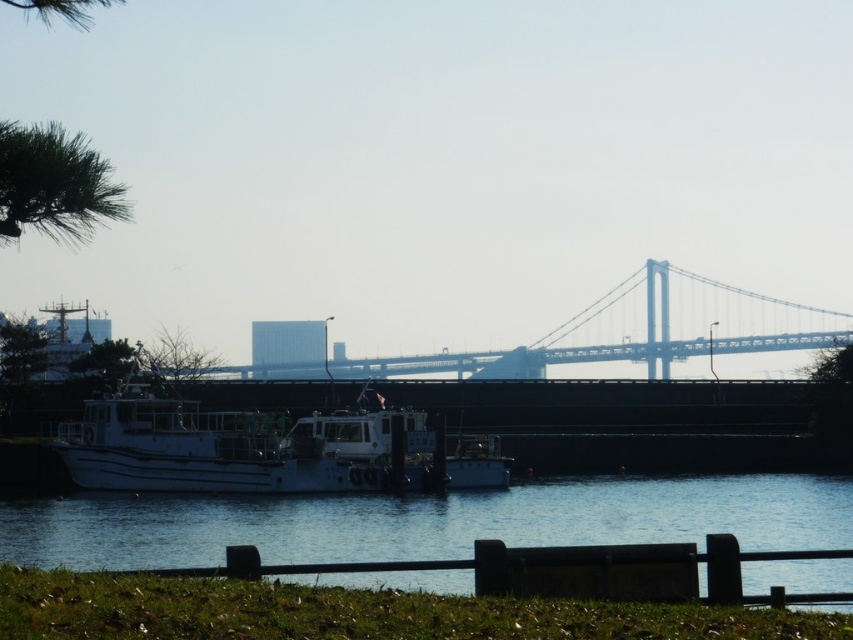
Consider the image. You are standing at the wooden fence in the foreground of the riverside scene. Looking towards the river, you notice a point marked at coordinates (428,522). What does this point indicate?

The point at (428,522) marks the location of blue water at lower center in the scene.

You are standing at the riverside and want to reach a specific point marked at coordinates point (68, 502). Your drone can fly up to 60 meters. Can your drone reach that point?

The distance of point (68, 502) from camera is 70.66 meters, so the drone cannot reach it since its maximum range is 60 meters.